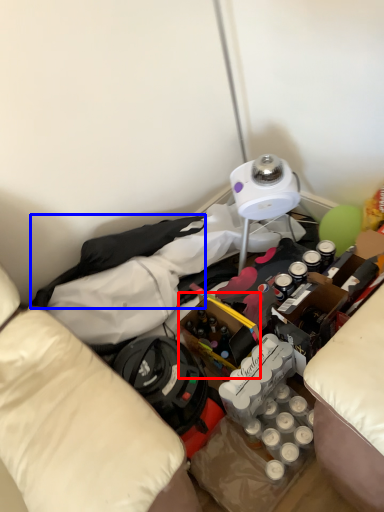
Question: Among these objects, which one is farthest to the camera, wine bottle (highlighted by a red box) or clothing (highlighted by a blue box)?

Choices:
 (A) wine bottle
 (B) clothing

Answer: (B)